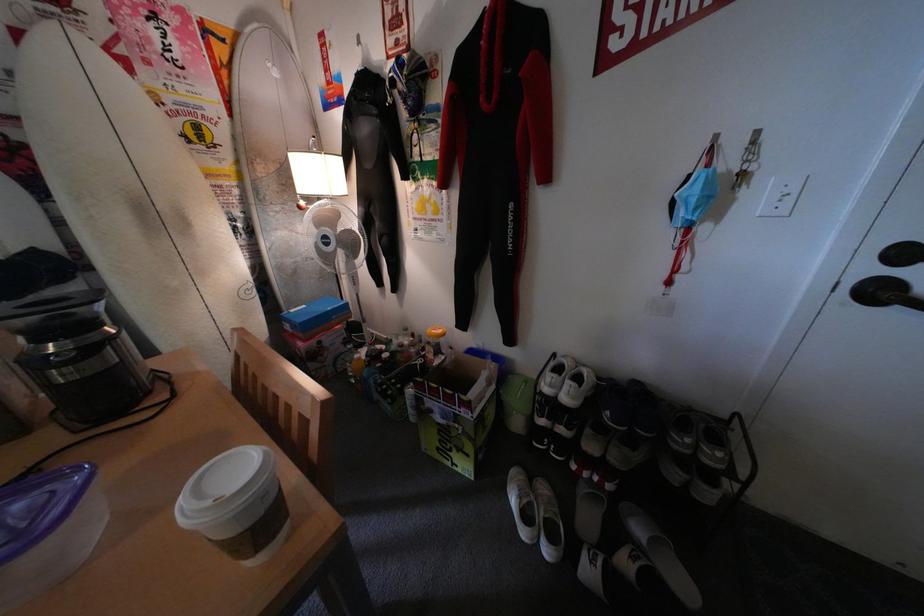
The image size is (924, 616). Find the location of `white paper cup`. white paper cup is located at coordinates (237, 504).